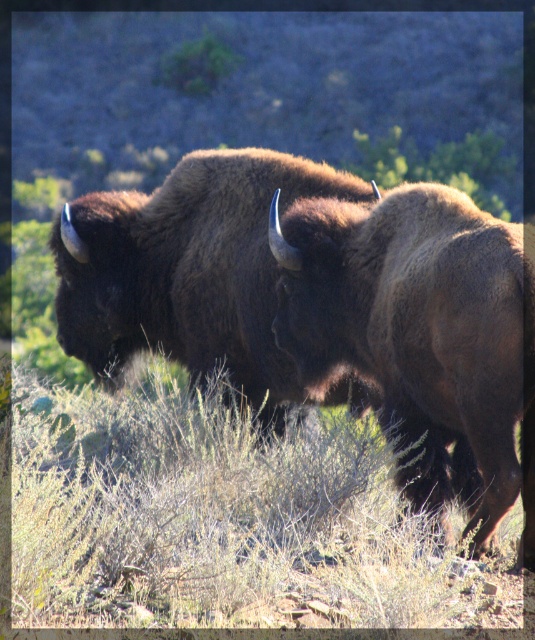
Question: Among these points, which one is farthest from the camera?

Choices:
 (A) (226, 198)
 (B) (291, 561)

Answer: (A)

Question: Among these objects, which one is farthest from the camera?

Choices:
 (A) brown fuzzy bison at center
 (B) dry grass at center

Answer: (A)

Question: Where is dry grass at center located in relation to brown fuzzy bison at center in the image?

Choices:
 (A) right
 (B) left

Answer: (B)

Question: Does dry grass at center lie behind brown fuzzy bison at center?

Choices:
 (A) no
 (B) yes

Answer: (A)

Question: Can you confirm if dry grass at center is positioned to the left of brown fuzzy bison at center?

Choices:
 (A) no
 (B) yes

Answer: (B)